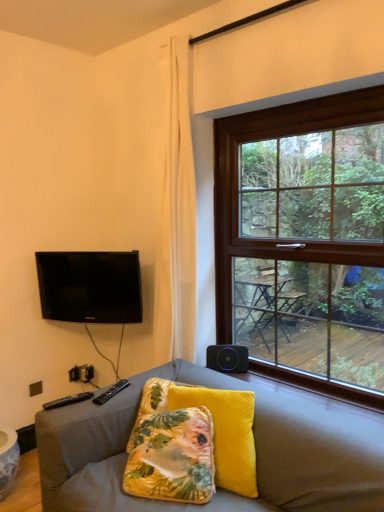
Question: Is brown wooden window at upper right positioned with its back to black glossy tv at upper left?

Choices:
 (A) yes
 (B) no

Answer: (B)

Question: Does brown wooden window at upper right contain black glossy tv at upper left?

Choices:
 (A) yes
 (B) no

Answer: (B)

Question: Considering the relative sizes of brown wooden window at upper right and black glossy tv at upper left in the image provided, is brown wooden window at upper right thinner than black glossy tv at upper left?

Choices:
 (A) no
 (B) yes

Answer: (A)

Question: From the image's perspective, does brown wooden window at upper right appear lower than black glossy tv at upper left?

Choices:
 (A) no
 (B) yes

Answer: (A)

Question: Can you confirm if brown wooden window at upper right is bigger than black glossy tv at upper left?

Choices:
 (A) yes
 (B) no

Answer: (A)

Question: In the image, is velvet floral pillow at center on the left side or the right side of black matte speaker at lower right?

Choices:
 (A) right
 (B) left

Answer: (B)

Question: In terms of size, does velvet floral pillow at center appear bigger or smaller than black matte speaker at lower right?

Choices:
 (A) small
 (B) big

Answer: (B)

Question: From the image's perspective, is velvet floral pillow at center above or below black matte speaker at lower right?

Choices:
 (A) above
 (B) below

Answer: (B)

Question: In the image, is velvet floral pillow at center positioned in front of or behind black matte speaker at lower right?

Choices:
 (A) behind
 (B) front

Answer: (B)

Question: From the image's perspective, is black plastic remote at lower left above or below black matte speaker at lower right?

Choices:
 (A) above
 (B) below

Answer: (B)

Question: Is black plastic remote at lower left wider or thinner than black matte speaker at lower right?

Choices:
 (A) thin
 (B) wide

Answer: (B)

Question: Considering the positions of point (94, 398) and point (221, 358), is point (94, 398) closer or farther from the camera than point (221, 358)?

Choices:
 (A) farther
 (B) closer

Answer: (B)

Question: Considering the positions of black plastic remote at lower left and black matte speaker at lower right in the image, is black plastic remote at lower left bigger or smaller than black matte speaker at lower right?

Choices:
 (A) small
 (B) big

Answer: (A)

Question: Choose the correct answer: Is black glossy tv at upper left inside velvet floral pillow at center or outside it?

Choices:
 (A) outside
 (B) inside

Answer: (A)

Question: Considering the positions of black glossy tv at upper left and velvet floral pillow at center in the image, is black glossy tv at upper left taller or shorter than velvet floral pillow at center?

Choices:
 (A) tall
 (B) short

Answer: (A)